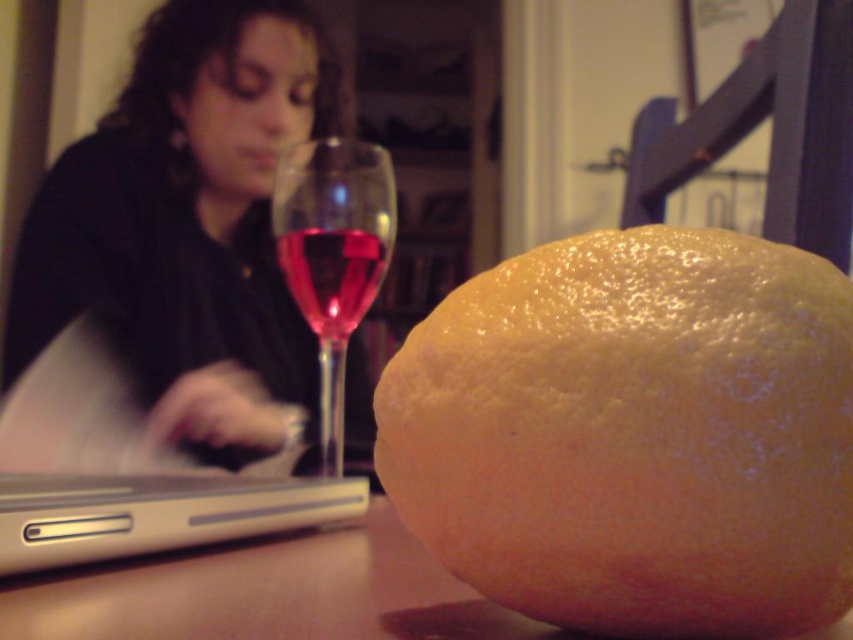
Between dark hair at upper left and silver metallic laptop at lower left, which one has more height?

Standing taller between the two is dark hair at upper left.

Looking at this image, who is more forward, [250,145] or [99,554]?

Point [99,554]

This screenshot has height=640, width=853. Identify the location of dark hair at upper left. (180, 252).

Who is more forward, (732, 333) or (341, 202)?

Point (732, 333)

Who is lower down, yellow matte grapefruit at center or transparent glass wine glass at left?

transparent glass wine glass at left is below.

Between point (566, 360) and point (294, 252), which one is positioned behind?

The point (294, 252) is behind.

The width and height of the screenshot is (853, 640). Identify the location of yellow matte grapefruit at center. (634, 435).

Is transparent glass wine glass at left taller than translucent glass wine at center?

Indeed, transparent glass wine glass at left has a greater height compared to translucent glass wine at center.

Is transparent glass wine glass at left further to camera compared to translucent glass wine at center?

No.

Which is in front, point (326, 374) or point (357, 289)?

Point (326, 374) is more forward.

At what (x,y) coordinates should I click in order to perform the action: click on transparent glass wine glass at left. Please return your answer as a coordinate pair (x, y). Looking at the image, I should click on (334, 253).